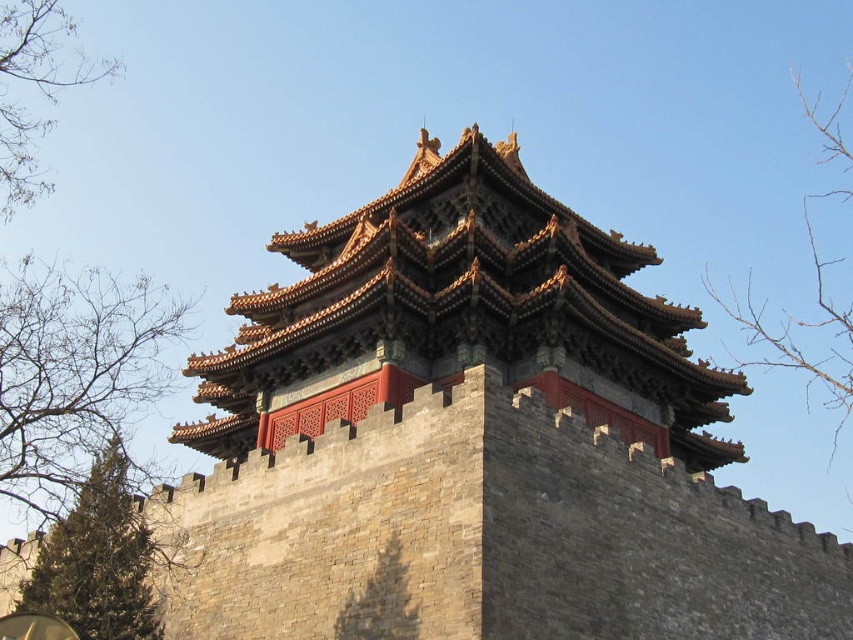
Can you confirm if green textured tree at lower left is smaller than bare branches at upper left?

Correct, green textured tree at lower left occupies less space than bare branches at upper left.

Does green textured tree at lower left appear on the right side of bare branches at upper left?

Indeed, green textured tree at lower left is positioned on the right side of bare branches at upper left.

The width and height of the screenshot is (853, 640). Find the location of `green textured tree at lower left`. green textured tree at lower left is located at coordinates (99, 561).

Is green textured tree at lower left smaller than bare branches at upper right?

Correct, green textured tree at lower left occupies less space than bare branches at upper right.

This screenshot has height=640, width=853. What do you see at coordinates (99, 561) in the screenshot? I see `green textured tree at lower left` at bounding box center [99, 561].

Who is more distant from viewer, (90,483) or (840,152)?

Point (840,152)

This screenshot has width=853, height=640. What are the coordinates of `green textured tree at lower left` in the screenshot? It's located at (99, 561).

Between bare branches at left and green textured tree at lower left, which one has less height?

With less height is green textured tree at lower left.

Who is higher up, bare branches at left or green textured tree at lower left?

Positioned higher is bare branches at left.

Locate an element on the screen. This screenshot has height=640, width=853. bare branches at left is located at coordinates (73, 372).

I want to click on bare branches at left, so click(73, 372).